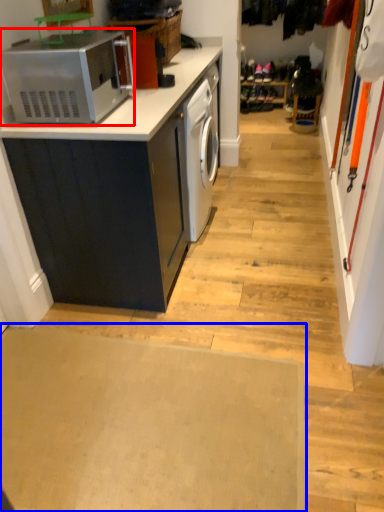
Question: Which object appears farthest to the camera in this image, home appliance (highlighted by a red box) or plain (highlighted by a blue box)?

Choices:
 (A) home appliance
 (B) plain

Answer: (A)